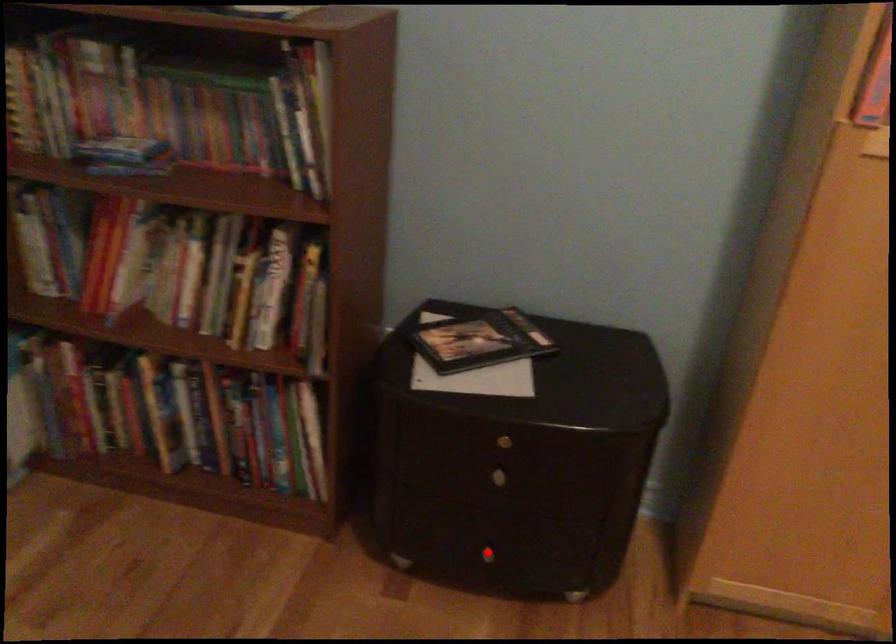
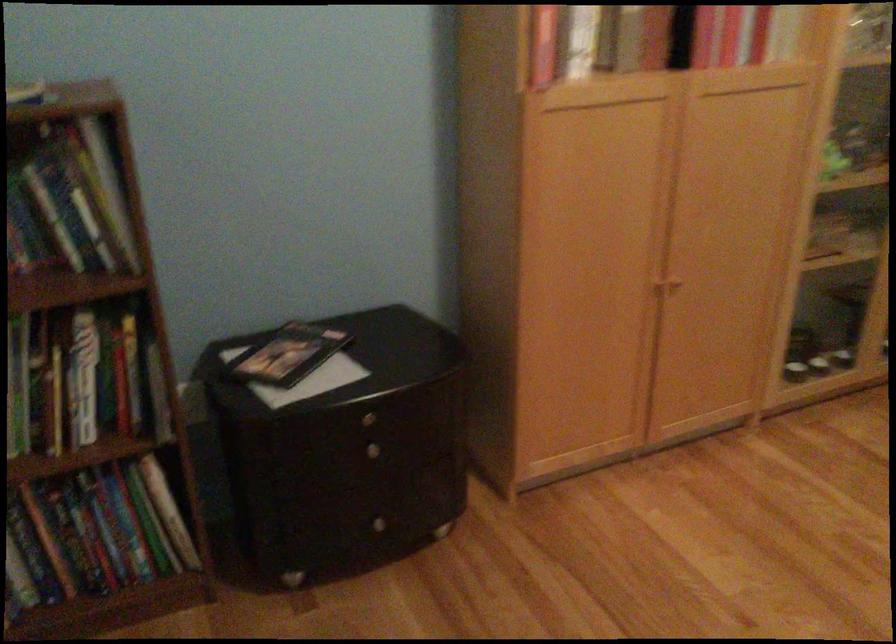
Question: I am providing you with two images of the same scene from different viewpoints. Image1 has a red point marked. In image2, the corresponding 3D location appears at what relative position? Reply with the corresponding letter.

Choices:
 (A) Closer
 (B) Farther

Answer: (B)